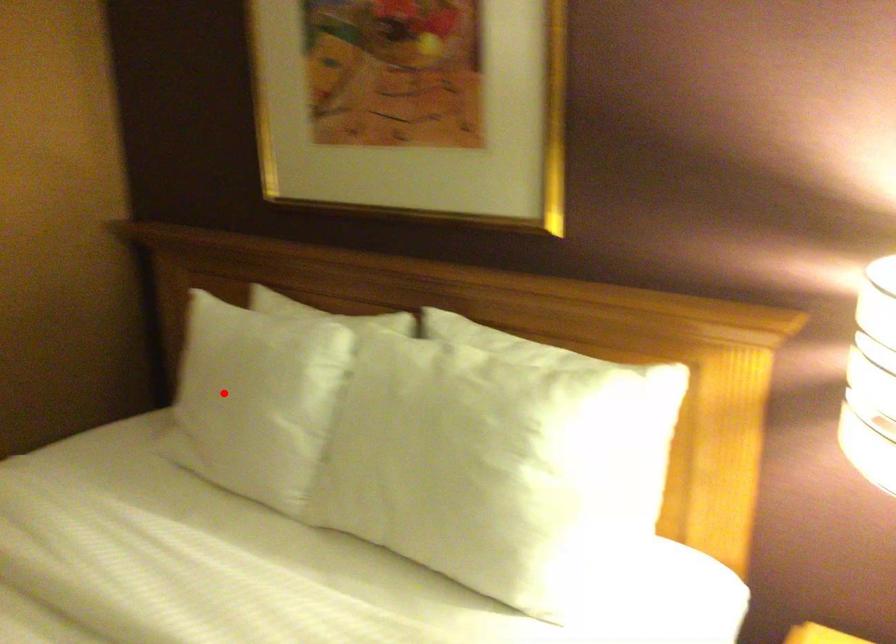
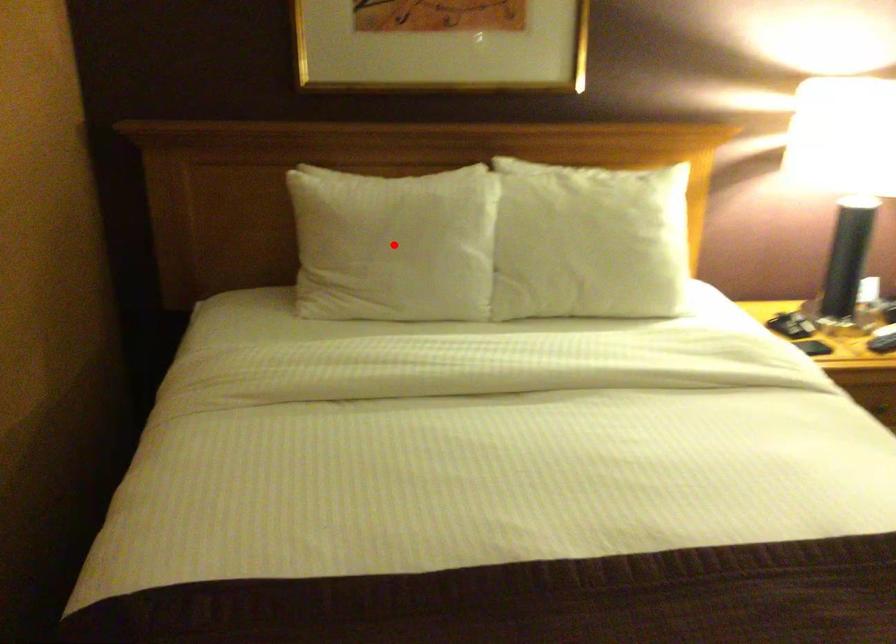
I am providing you with two images of the same scene from different viewpoints. A red point is marked on the first image and another point is marked on the second image. Are the points marked in image1 and image2 representing the same 3D position?

Yes